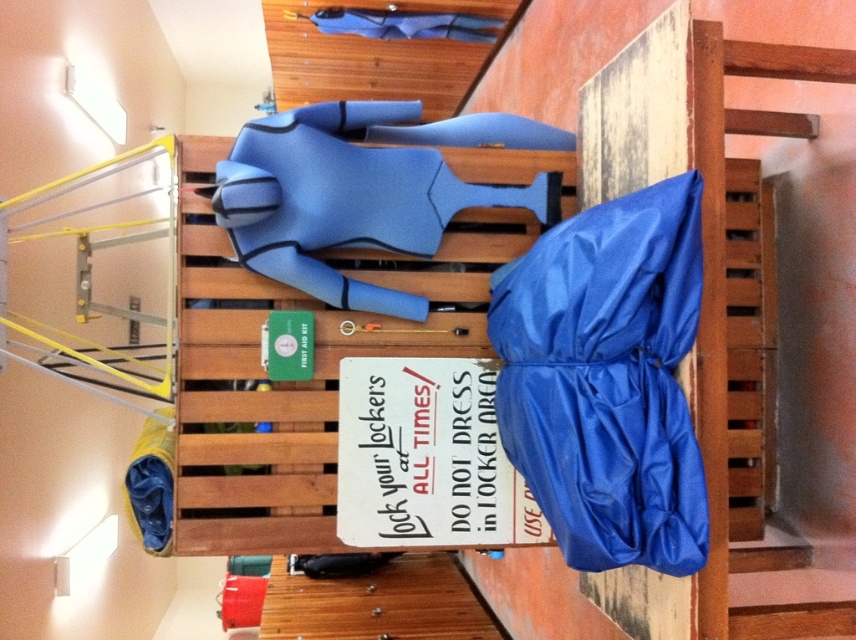
In the scene shown: Between blue nylon bag at right and blue rubber wetsuit at center, which one has less height?

blue nylon bag at right

Is point (560, 490) behind point (206, 321)?

No.

At what (x,y) coordinates should I click in order to perform the action: click on blue nylon bag at right. Please return your answer as a coordinate pair (x, y). Looking at the image, I should click on (607, 378).